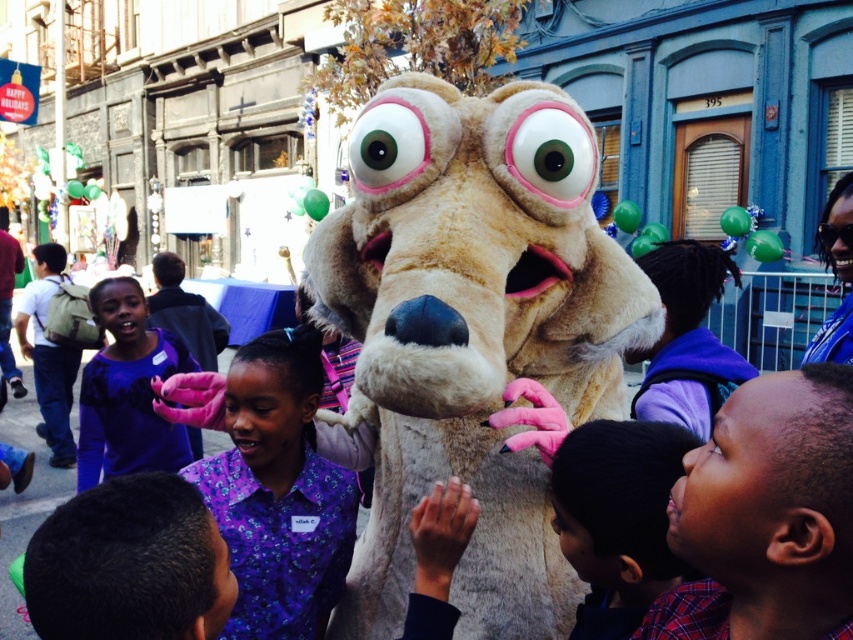
Question: Which object is the closest to the fluffy beige costume at center?

Choices:
 (A) smooth purple shirt at lower right
 (B) purple floral shirt at center
 (C) purple fabric shirt at center

Answer: (A)

Question: Which of the following is the closest to the observer?

Choices:
 (A) (248, 400)
 (B) (367, 276)
 (C) (172, 440)
 (D) (672, 582)

Answer: (D)

Question: Can you confirm if purple floral shirt at center is bigger than purple fabric shirt at center?

Choices:
 (A) yes
 (B) no

Answer: (B)

Question: Does fluffy beige costume at center have a lesser width compared to purple fabric shirt at center?

Choices:
 (A) yes
 (B) no

Answer: (A)

Question: Is fluffy beige costume at center in front of purple fabric shirt at center?

Choices:
 (A) no
 (B) yes

Answer: (B)

Question: Which object is positioned closest to the purple floral shirt at center?

Choices:
 (A) smooth purple shirt at lower right
 (B) fluffy beige costume at center

Answer: (B)